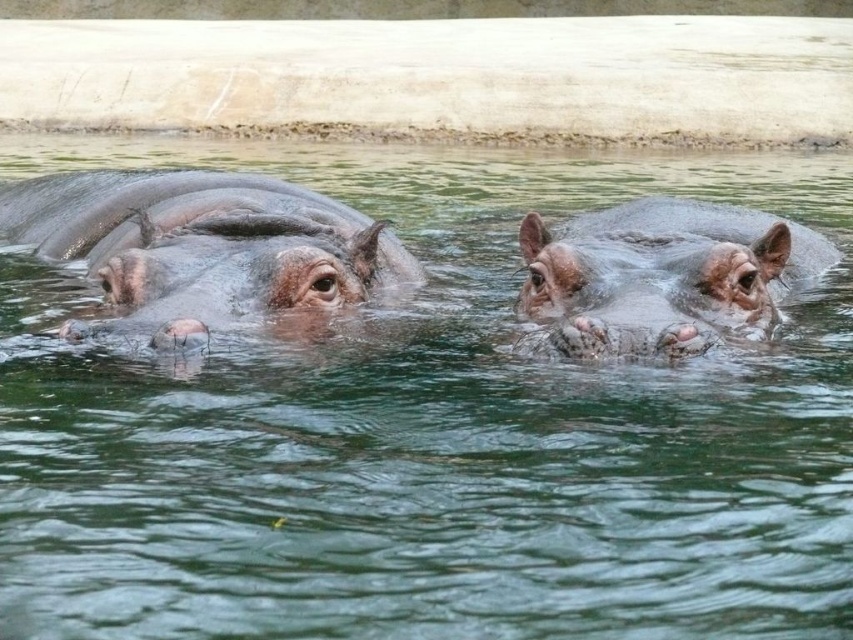
Question: Which object appears closest to the camera in this image?

Choices:
 (A) sandy brown skin at center
 (B) pinkish-brown skin at center

Answer: (A)

Question: Does pinkish-brown skin at center have a larger size compared to sandy brown skin at center?

Choices:
 (A) no
 (B) yes

Answer: (B)

Question: Among these objects, which one is farthest from the camera?

Choices:
 (A) sandy brown skin at center
 (B) pinkish-brown skin at center

Answer: (B)

Question: Does pinkish-brown skin at center appear on the right side of sandy brown skin at center?

Choices:
 (A) no
 (B) yes

Answer: (A)

Question: Can you confirm if pinkish-brown skin at center is positioned to the right of sandy brown skin at center?

Choices:
 (A) yes
 (B) no

Answer: (B)

Question: Which of the following is the closest to the observer?

Choices:
 (A) pinkish-brown skin at center
 (B) sandy brown skin at center

Answer: (B)